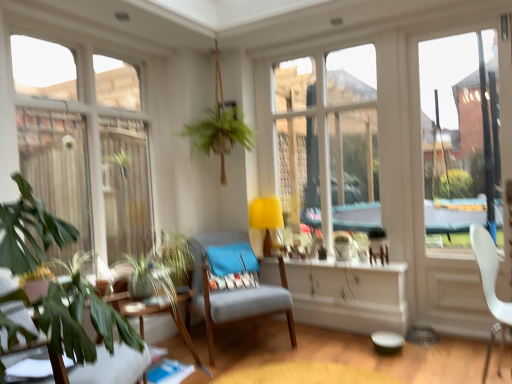
Where is `vacant space in textured gray chair at center, arranged as the 3th chair when viewed from the front (from a real-world perspective)`? This screenshot has width=512, height=384. vacant space in textured gray chair at center, arranged as the 3th chair when viewed from the front (from a real-world perspective) is located at coordinates (248, 332).